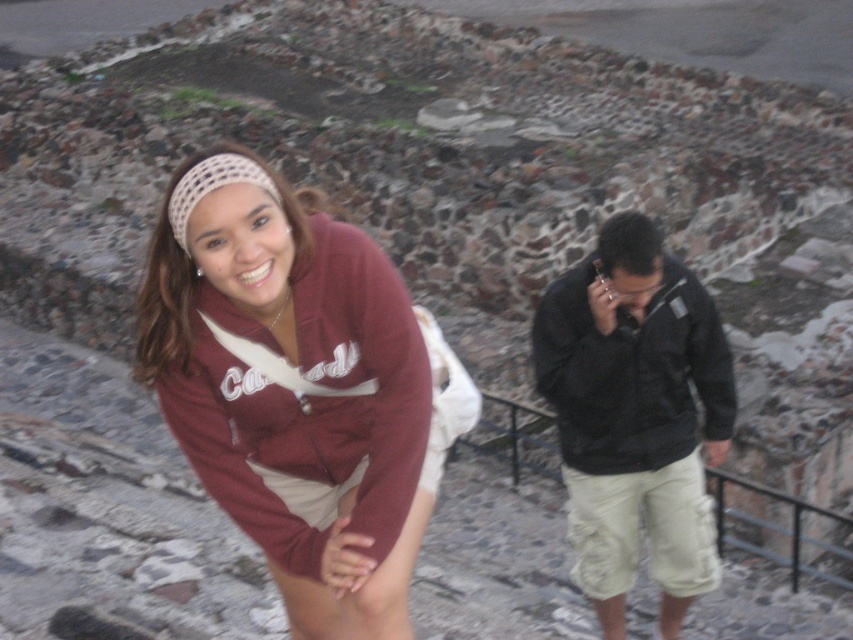
You are a photographer trying to capture a clear shot of the matte maroon hoodie at center and the black matte jacket at right. Which object should you focus on first to ensure both are in focus?

The matte maroon hoodie at center should be focused on first because it is positioned over the black matte jacket at right, meaning it is closer to the camera. By focusing on the closer object, both will be in focus if they are within the depth of field.

You are a photographer trying to capture both the matte maroon hoodie at center and the black matte jacket at right in a single shot. The camera you are using has a maximum focus range of 2.5 meters. Will both subjects be in focus?

The distance between the matte maroon hoodie at center and the black matte jacket at right is 2.43 meters, which is within the camera maximum focus range of 2.5 meters. Therefore, both subjects will be in focus.

You are a photographer trying to capture both the matte maroon hoodie at center and the black matte jacket at right in the same frame. Which clothing item should you focus on first to ensure both are in the frame?

The matte maroon hoodie at center is larger in size compared to the black matte jacket at right, so you should focus on the matte maroon hoodie at center first to ensure both are in the frame.